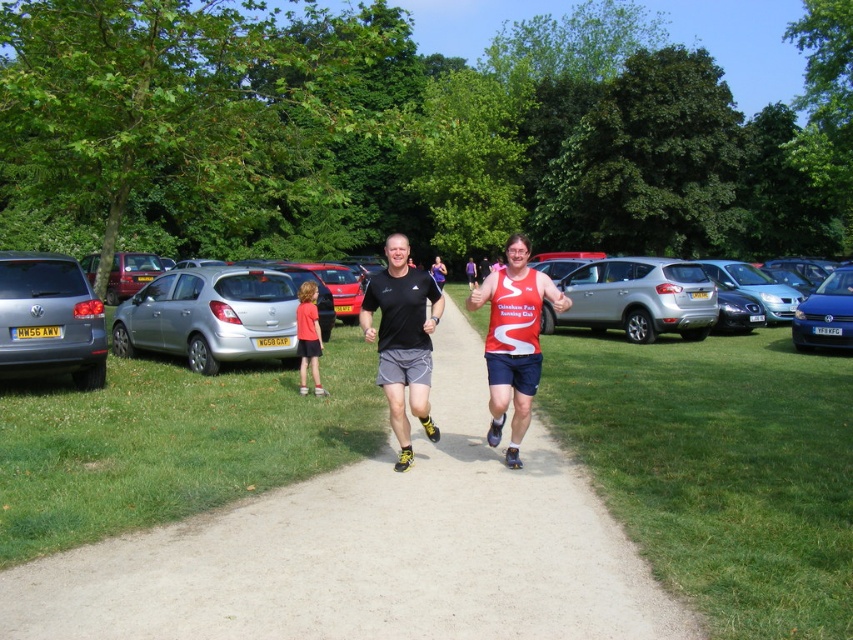
Who is taller, black matte running shoes at center or silver metallic hatchback at left?

black matte running shoes at center is taller.

The image size is (853, 640). What do you see at coordinates (402, 339) in the screenshot? I see `black matte running shoes at center` at bounding box center [402, 339].

Who is more forward, (392, 419) or (125, 284)?

Point (392, 419) is in front.

Identify the location of black matte running shoes at center. (402, 339).

Does silver metallic suv at center-right have a greater width compared to black matte running shoes at center?

Indeed, silver metallic suv at center-right has a greater width compared to black matte running shoes at center.

Does silver metallic suv at center-right have a lesser height compared to black matte running shoes at center?

Correct, silver metallic suv at center-right is not as tall as black matte running shoes at center.

Which is in front, point (587, 278) or point (393, 236)?

Point (393, 236) is more forward.

The height and width of the screenshot is (640, 853). I want to click on silver metallic suv at center-right, so click(636, 298).

This screenshot has height=640, width=853. What do you see at coordinates (372, 550) in the screenshot? I see `smooth concrete path at center` at bounding box center [372, 550].

This screenshot has width=853, height=640. Identify the location of smooth concrete path at center. (372, 550).